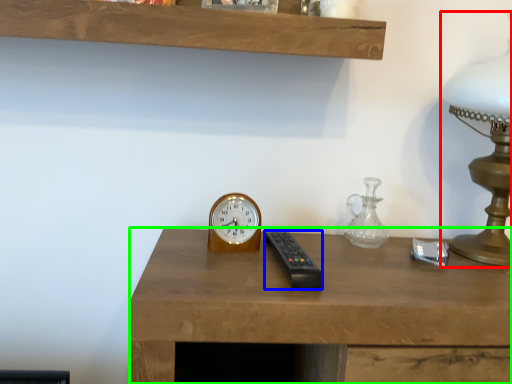
Question: Which object is positioned farthest from table lamp (highlighted by a red box)? Select from control (highlighted by a blue box) and desk (highlighted by a green box).

Choices:
 (A) control
 (B) desk

Answer: (A)